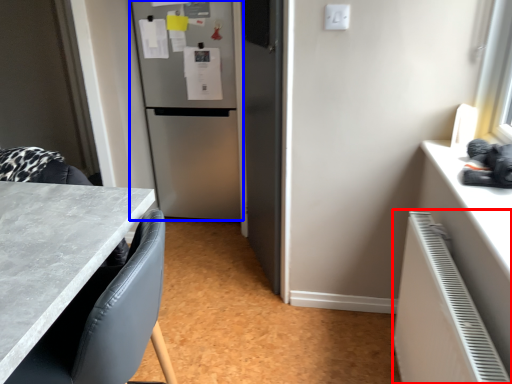
Question: Which point is closer to the camera, radiator (highlighted by a red box) or refrigerator (highlighted by a blue box)?

Choices:
 (A) radiator
 (B) refrigerator

Answer: (A)